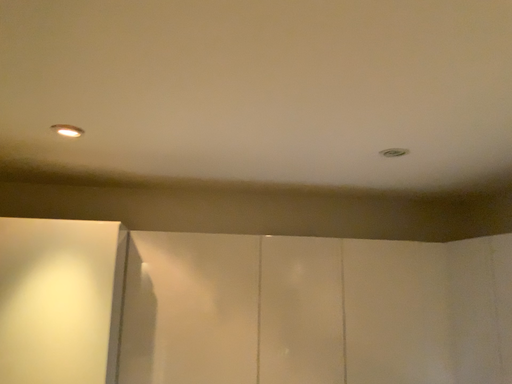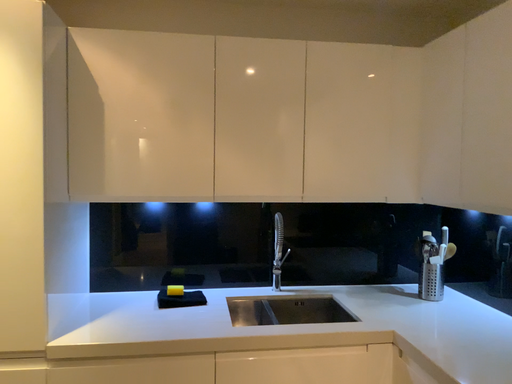
Question: Which way did the camera rotate in the video?

Choices:
 (A) rotated upward
 (B) rotated downward

Answer: (B)